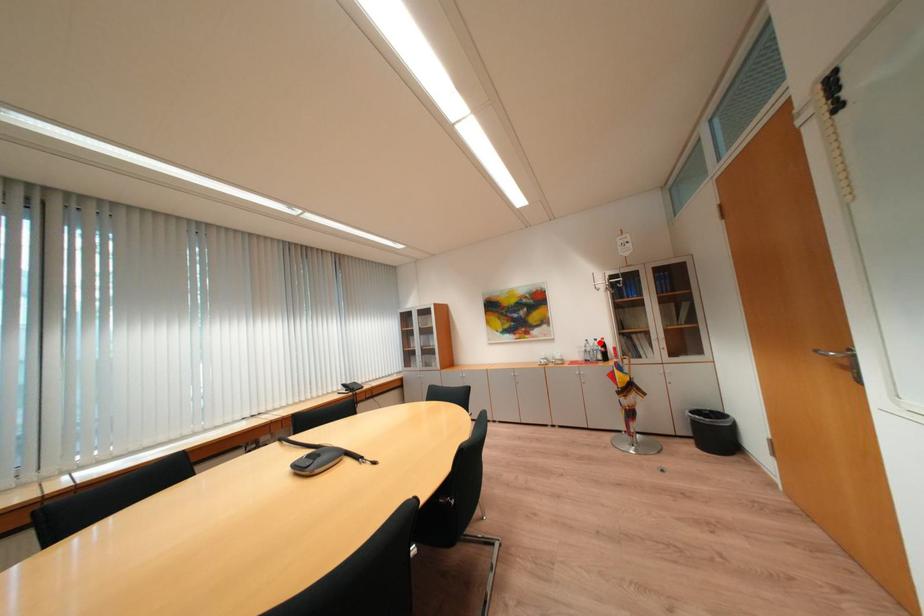
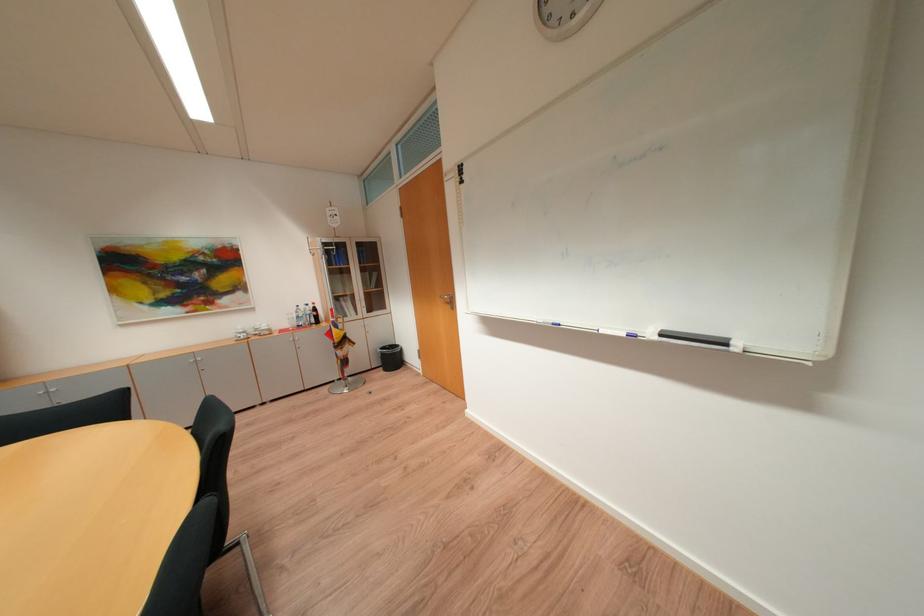
Question: I am providing you with two images of the same scene from different viewpoints. Image1 has a red point marked. In image2, the corresponding 3D location appears at what relative position? Reply with the corresponding letter.

Choices:
 (A) Closer
 (B) Farther

Answer: (A)